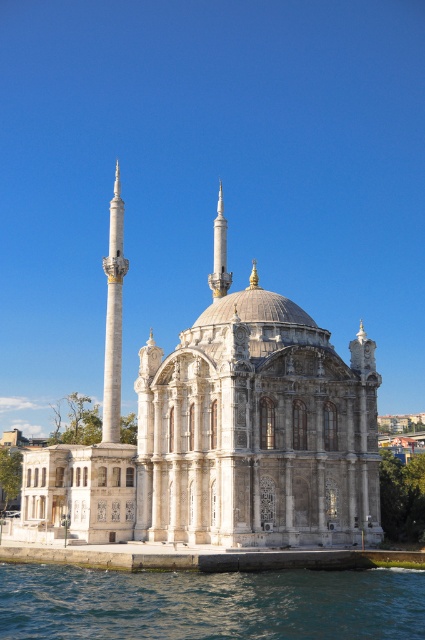
You are standing in front of the grand mosque and want to locate two specific points marked on the structure. The first point is at coordinates point (357,452) and the second is at point (116,330). Which of these two points is positioned closer to your current viewpoint?

Point (357,452) is closer to the viewer than point (116,330).

You are standing in front of the grand mosque and notice the blue water at lower center. Based on its position, can you determine if it is closer to the central dome or the minarets?

The blue water at lower center is located at point coordinates that place it closer to the central dome than the minarets.

Based on the photo, you are an architect planning to build a replica of the mosque and its minaret. Given that the white marble minaret at left is 10 meters wide, can you estimate the minimum width required for the white stone mosque at center to maintain the original proportions?

The white stone mosque at center is wider than the white marble minaret at left. Since the minaret is 10 meters wide, the mosque must be wider than 10 meters to maintain the original proportions.